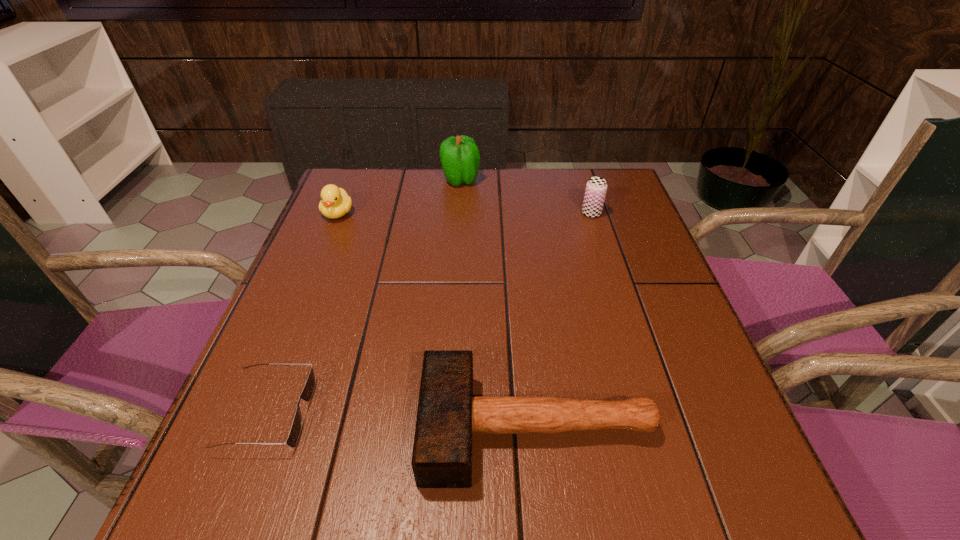
What are the coordinates of `empty space that is in between the farthest object and the shortest object` in the screenshot? It's located at (365, 296).

Locate an element on the screen. The height and width of the screenshot is (540, 960). free space between the duckling and the beer can is located at coordinates (465, 213).

You are a GUI agent. You are given a task and a screenshot of the screen. Output one action in this format:
    pyautogui.click(x=<x>, y=<y>)
    Task: Click on the free space between the duckling and the beer can
    The image size is (960, 540).
    Given the screenshot: What is the action you would take?
    pyautogui.click(x=465, y=213)

Where is `vacant area that lies between the mallet and the sunglasses`? This screenshot has width=960, height=540. vacant area that lies between the mallet and the sunglasses is located at coordinates (402, 421).

Where is `empty location between the mallet and the shortest object`? The height and width of the screenshot is (540, 960). empty location between the mallet and the shortest object is located at coordinates (402, 421).

Where is `vacant area between the shortest object and the duckling`? vacant area between the shortest object and the duckling is located at coordinates (303, 313).

Identify the location of vacant area that lies between the bell pepper and the mallet. (499, 304).

Find the location of a particular element. empty location between the duckling and the beer can is located at coordinates (465, 213).

Identify the location of free space between the beer can and the farthest object. This screenshot has width=960, height=540. (526, 197).

Image resolution: width=960 pixels, height=540 pixels. I want to click on the second closest object to the shortest object, so click(335, 202).